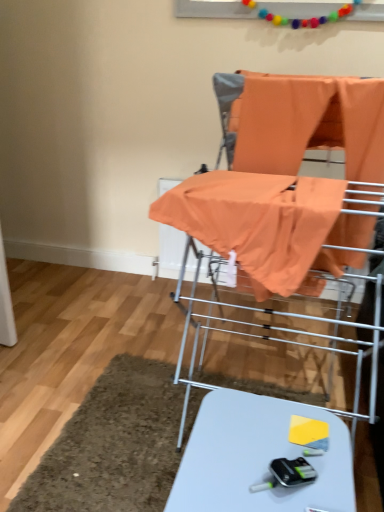
Question: Looking at their shapes, would you say orange fabric at center is wider or thinner than white glossy table at lower center?

Choices:
 (A) thin
 (B) wide

Answer: (B)

Question: From a real-world perspective, is orange fabric at center positioned above or below white glossy table at lower center?

Choices:
 (A) below
 (B) above

Answer: (B)

Question: Which object is positioned farthest from the white glossy table at lower center?

Choices:
 (A) orange fabric baby carriage at center
 (B) orange fabric at center

Answer: (B)

Question: Which object is positioned closest to the orange fabric at center?

Choices:
 (A) white glossy table at lower center
 (B) orange fabric baby carriage at center

Answer: (B)